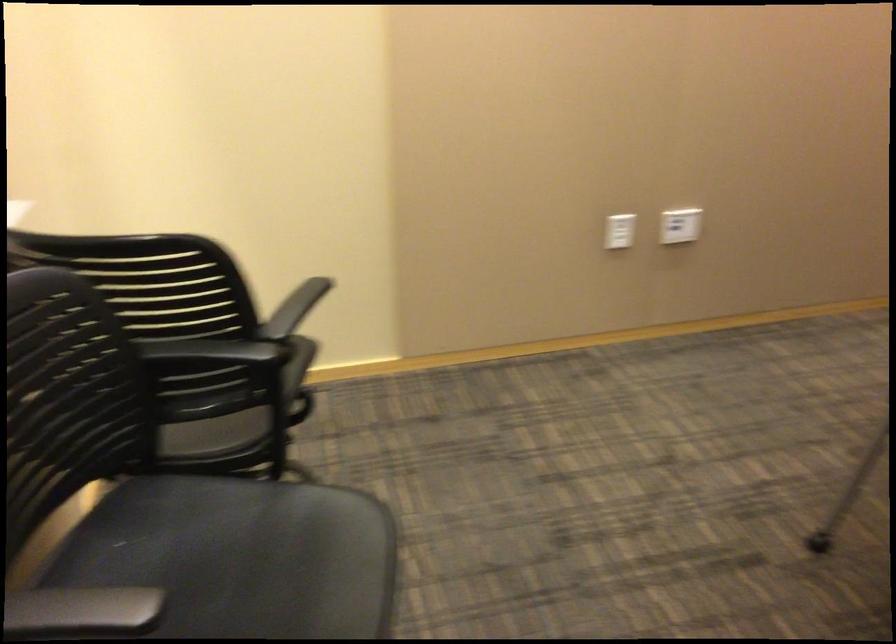
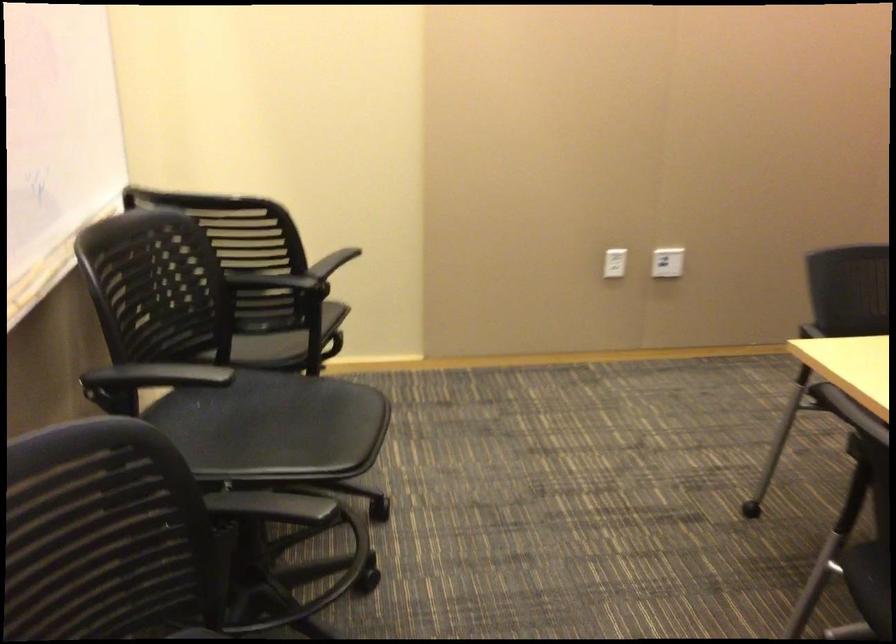
Question: In a continuous first-person perspective shot, in which direction is the camera moving?

Choices:
 (A) Left
 (B) Right
 (C) Forward
 (D) Backward

Answer: (D)